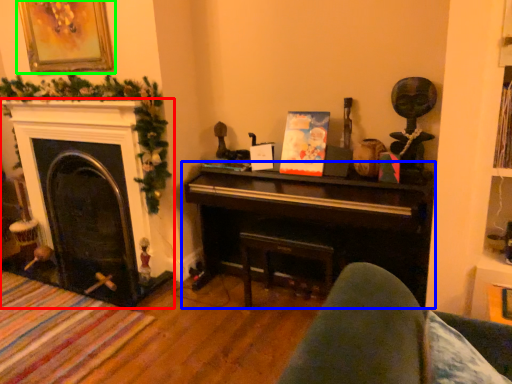
Question: Considering the real-world distances, which object is closest to fireplace (highlighted by a red box)? piano (highlighted by a blue box) or picture frame (highlighted by a green box).

Choices:
 (A) piano
 (B) picture frame

Answer: (B)